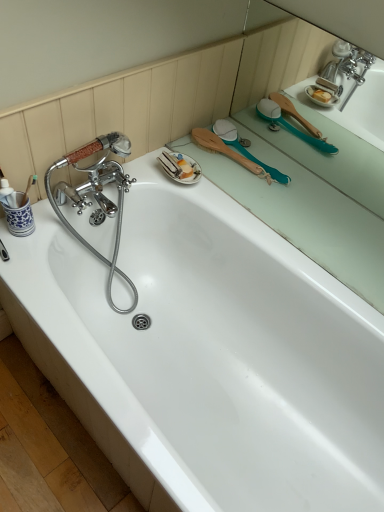
Question: Based on their sizes in the image, would you say green rubber brush at upper right, the 1th mirror from the top, is bigger or smaller than teal rubber brush at upper right, the first mirror ordered from the bottom?

Choices:
 (A) big
 (B) small

Answer: (A)

Question: In the image, is green rubber brush at upper right, the 1th mirror from the top, positioned in front of or behind teal rubber brush at upper right, the second mirror in the top-to-bottom sequence?

Choices:
 (A) front
 (B) behind

Answer: (A)

Question: Estimate the real-world distances between objects in this image. Which object is closer to the green rubber brush at upper right, the 2th mirror from the bottom?

Choices:
 (A) wooden-brushed teal brush at upper right
 (B) teal rubber brush at upper right, the first mirror ordered from the bottom
 (C) white glossy bathtub at upper center

Answer: (B)

Question: Which object is the closest to the teal rubber brush at upper right, the second mirror in the top-to-bottom sequence?

Choices:
 (A) green rubber brush at upper right, the 1th mirror from the top
 (B) wooden-brushed teal brush at upper right
 (C) white glossy bathtub at upper center

Answer: (A)